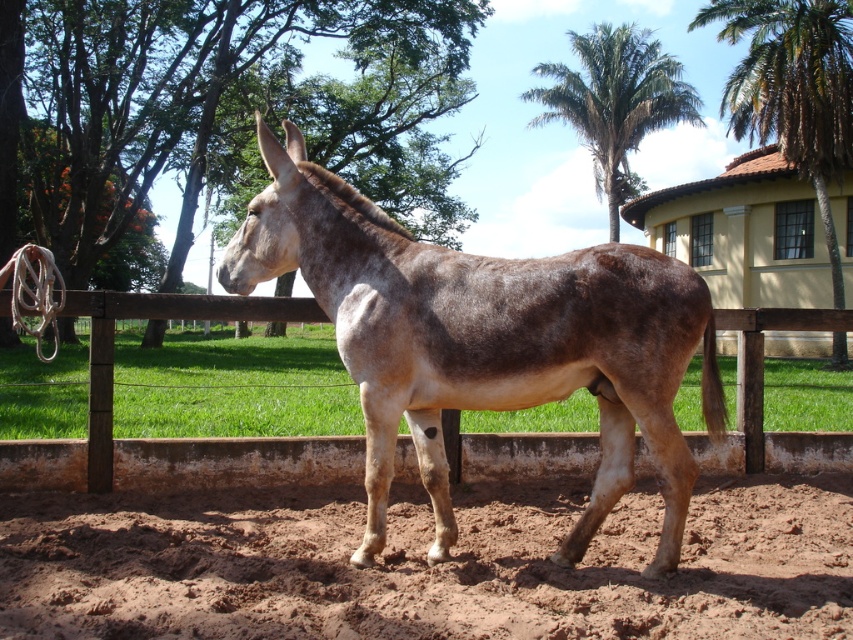
Question: Which of the following is the closest to the observer?

Choices:
 (A) brown speckled fur at center
 (B) brown sandy soil at lower center
 (C) green leafy palm tree at upper right
 (D) green leafy palm at upper center

Answer: (B)

Question: Which point is farther from the camera taking this photo?

Choices:
 (A) (120, 554)
 (B) (485, 298)
 (C) (625, 109)
 (D) (840, 81)

Answer: (C)

Question: Which point is closer to the camera?

Choices:
 (A) (636, 76)
 (B) (363, 570)
 (C) (804, 36)
 (D) (38, 440)

Answer: (B)

Question: Does brown sandy soil at lower center appear under brown wooden fence at center?

Choices:
 (A) no
 (B) yes

Answer: (B)

Question: Does brown wooden fence at center lie behind green leafy palm tree at upper right?

Choices:
 (A) yes
 (B) no

Answer: (B)

Question: From the image, what is the correct spatial relationship of brown sandy soil at lower center in relation to brown wooden fence at center?

Choices:
 (A) right
 (B) left

Answer: (B)